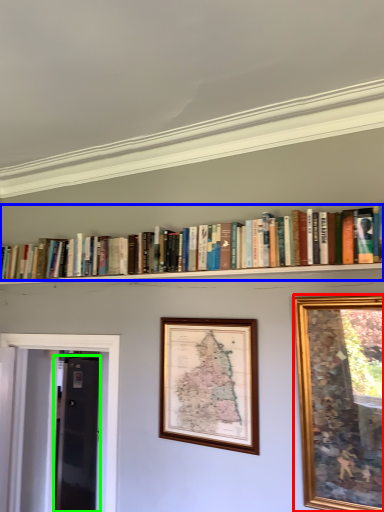
Question: Which object is positioned farthest from picture frame (highlighted by a red box)? Select from book (highlighted by a blue box) and glass door (highlighted by a green box).

Choices:
 (A) book
 (B) glass door

Answer: (B)